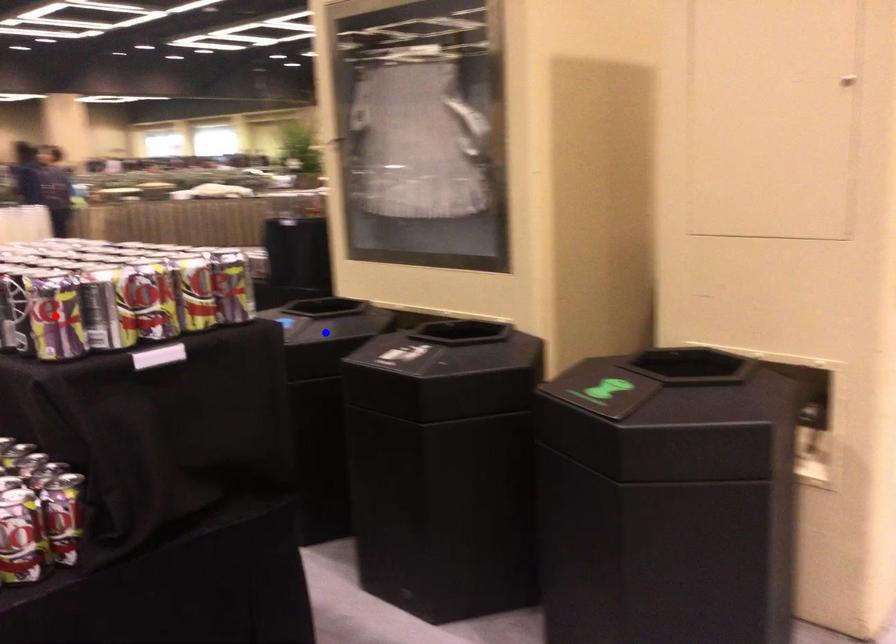
Question: Which of the two points in the image is closer to the camera?

Choices:
 (A) Blue point is closer.
 (B) Red point is closer.

Answer: (B)